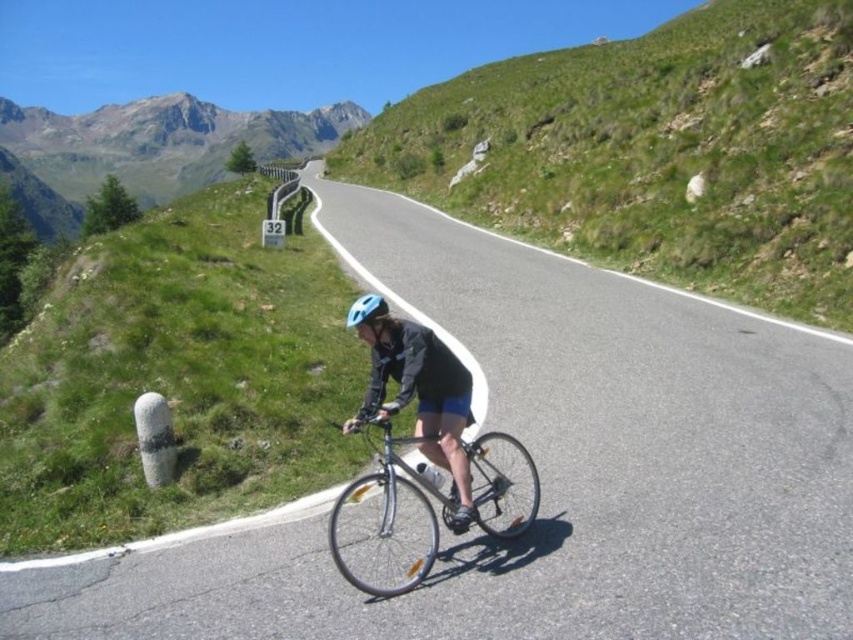
The height and width of the screenshot is (640, 853). Describe the element at coordinates (654, 150) in the screenshot. I see `green grassy hillside at upper center` at that location.

Is green grassy hillside at upper center wider than matte blue helmet at center?

Correct, the width of green grassy hillside at upper center exceeds that of matte blue helmet at center.

Which is behind, point (390, 173) or point (376, 308)?

The point (390, 173) is behind.

Locate an element on the screen. The image size is (853, 640). green grassy hillside at upper center is located at coordinates (654, 150).

Between point (433, 490) and point (378, 307), which one is positioned behind?

Positioned behind is point (378, 307).

Does shiny metallic bicycle at center appear under matte blue helmet at center?

Indeed, shiny metallic bicycle at center is positioned under matte blue helmet at center.

Is point (502, 481) positioned before point (386, 310)?

No.

Where is `shiny metallic bicycle at center`? This screenshot has width=853, height=640. shiny metallic bicycle at center is located at coordinates (386, 506).

Is the position of rugged granite mountain at upper left more distant than that of matte black helmet at center?

That is True.

Between rugged granite mountain at upper left and matte black helmet at center, which one has less height?

matte black helmet at center is shorter.

Between point (10, 124) and point (398, 333), which one is positioned in front?

Point (398, 333)

This screenshot has height=640, width=853. In order to click on rugged granite mountain at upper left in this screenshot , I will do `click(144, 148)`.